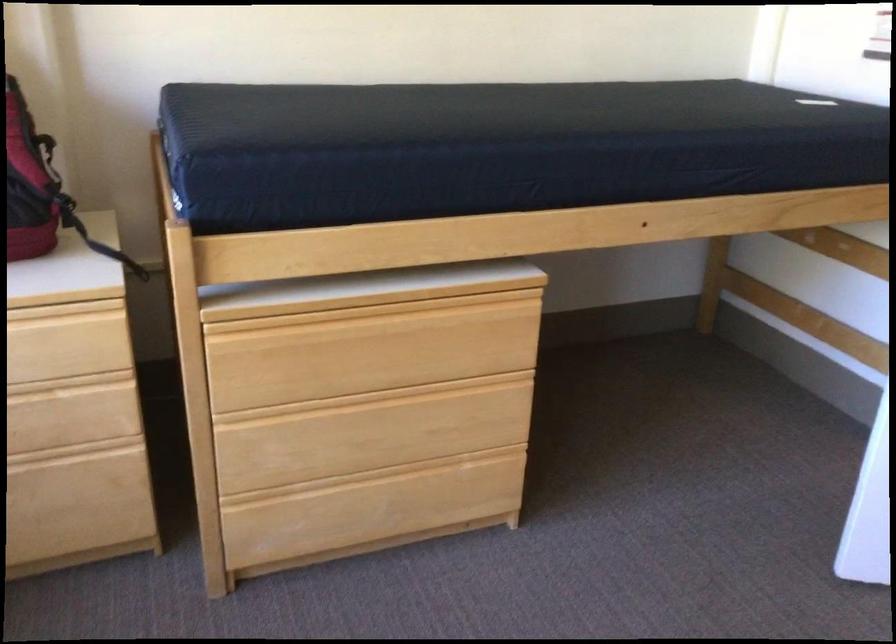
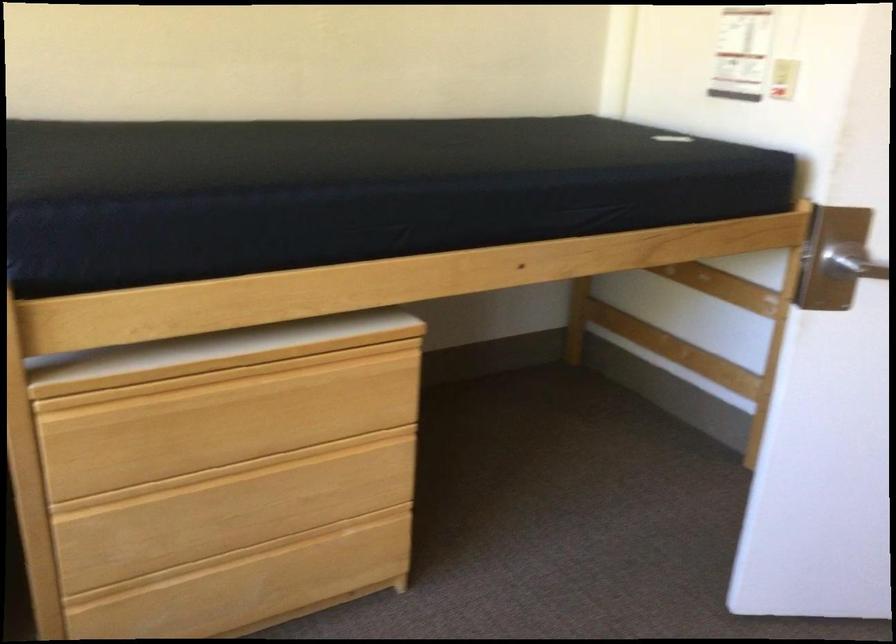
The point at (400, 412) is marked in the first image. Where is the corresponding point in the second image?

(266, 486)